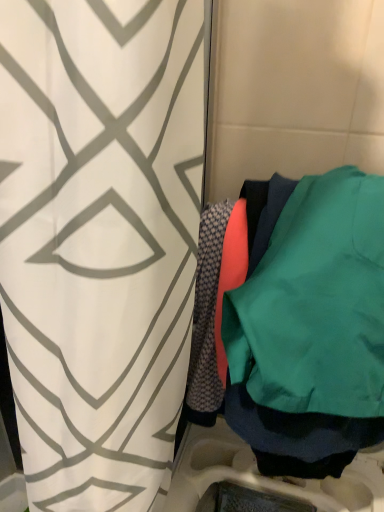
Question: From a real-world perspective, is white geometric-patterned curtain at center below teal matte sweatshirt at right?

Choices:
 (A) no
 (B) yes

Answer: (B)

Question: Can you confirm if white geometric-patterned curtain at center is shorter than teal matte sweatshirt at right?

Choices:
 (A) no
 (B) yes

Answer: (A)

Question: From a real-world perspective, is white geometric-patterned curtain at center on teal matte sweatshirt at right?

Choices:
 (A) yes
 (B) no

Answer: (B)

Question: Considering the relative sizes of white geometric-patterned curtain at center and teal matte sweatshirt at right in the image provided, is white geometric-patterned curtain at center taller than teal matte sweatshirt at right?

Choices:
 (A) yes
 (B) no

Answer: (A)

Question: Is white geometric-patterned curtain at center positioned beyond the bounds of teal matte sweatshirt at right?

Choices:
 (A) no
 (B) yes

Answer: (B)

Question: Considering the relative sizes of white geometric-patterned curtain at center and teal matte sweatshirt at right in the image provided, is white geometric-patterned curtain at center thinner than teal matte sweatshirt at right?

Choices:
 (A) no
 (B) yes

Answer: (A)

Question: Is teal matte sweatshirt at right next to white geometric-patterned curtain at center and touching it?

Choices:
 (A) yes
 (B) no

Answer: (B)

Question: Does teal matte sweatshirt at right have a lesser height compared to white geometric-patterned curtain at center?

Choices:
 (A) yes
 (B) no

Answer: (A)

Question: Is teal matte sweatshirt at right taller than white geometric-patterned curtain at center?

Choices:
 (A) no
 (B) yes

Answer: (A)

Question: Is teal matte sweatshirt at right oriented away from white geometric-patterned curtain at center?

Choices:
 (A) no
 (B) yes

Answer: (A)

Question: Is teal matte sweatshirt at right at the right side of white geometric-patterned curtain at center?

Choices:
 (A) no
 (B) yes

Answer: (B)

Question: Are teal matte sweatshirt at right and white geometric-patterned curtain at center located far from each other?

Choices:
 (A) no
 (B) yes

Answer: (A)

Question: Looking at the image, does teal matte sweatshirt at right seem bigger or smaller compared to white geometric-patterned curtain at center?

Choices:
 (A) small
 (B) big

Answer: (A)